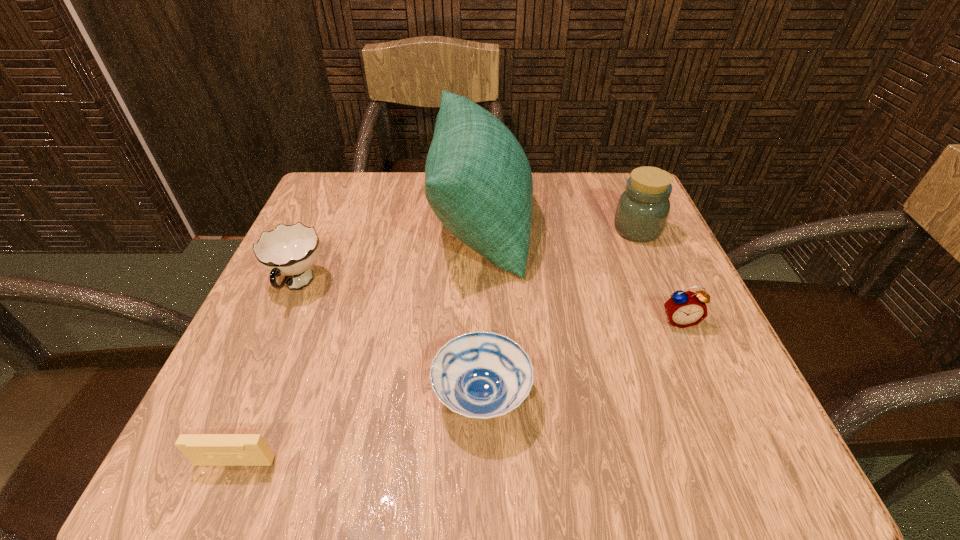
Where is `cushion`? Image resolution: width=960 pixels, height=540 pixels. cushion is located at coordinates (478, 181).

Identify the location of jar. pos(642,211).

Where is `cup`? cup is located at coordinates (288, 250).

Identify the location of alarm clock. (684, 309).

At what (x,y) coordinates should I click in order to perform the action: click on soup bowl. Please return your answer as a coordinate pair (x, y). This screenshot has width=960, height=540. Looking at the image, I should click on (482, 375).

Where is `the nearest object`? the nearest object is located at coordinates (201, 449).

Identify the location of vacant space located on the front-facing side of the cushion. Image resolution: width=960 pixels, height=540 pixels. (624, 221).

Identify the location of free space located 0.150m on the left of the fifth shortest object. The image size is (960, 540). (540, 230).

Where is `free space located on the side of the cup with the handle`? free space located on the side of the cup with the handle is located at coordinates (257, 377).

At what (x,y) coordinates should I click in order to perform the action: click on vacant position located on the front-facing side of the alarm clock. Please return your answer as a coordinate pair (x, y). The width and height of the screenshot is (960, 540). Looking at the image, I should click on (708, 387).